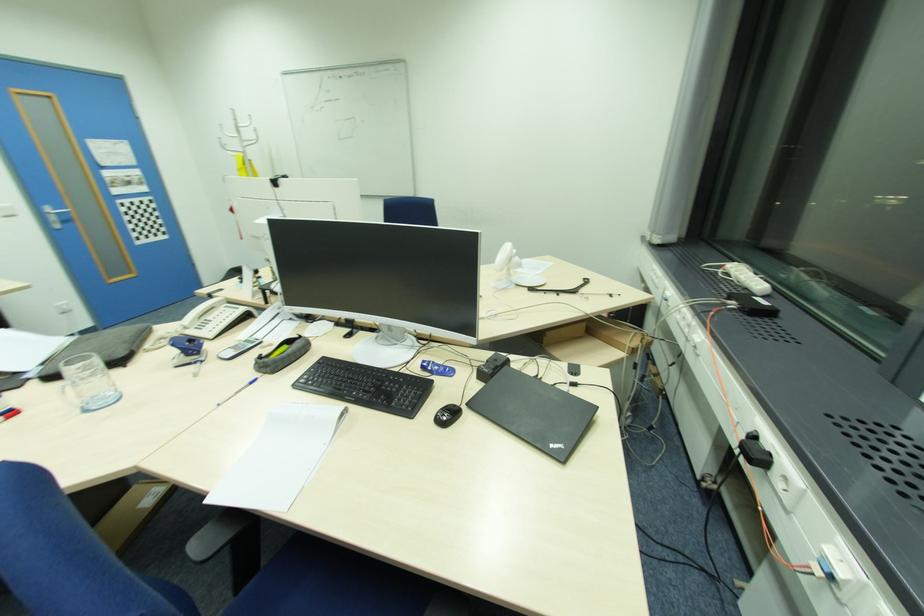
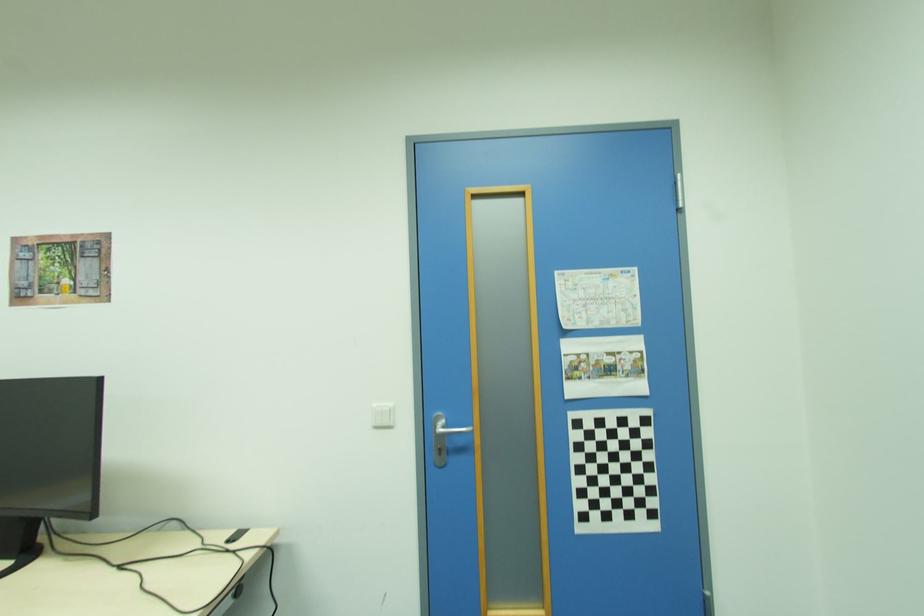
Locate, in the second image, the point that corresponds to the point at 120,164 in the first image.

(599, 325)